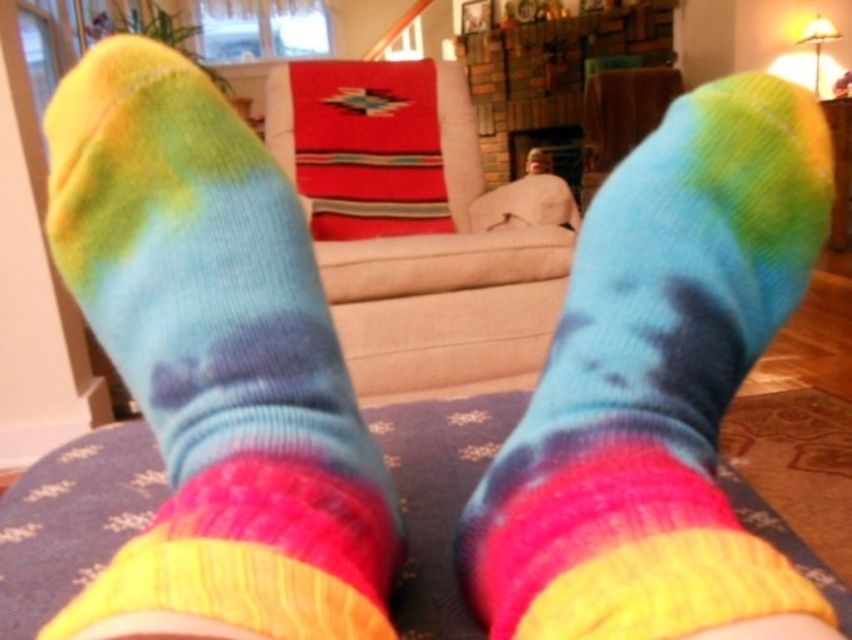
Question: Which point is farther from the camera taking this photo?

Choices:
 (A) (131, 300)
 (B) (41, 598)
 (C) (790, 589)

Answer: (B)

Question: Can you confirm if tie-dye knit sock at center is bigger than textured blue mat at center?

Choices:
 (A) no
 (B) yes

Answer: (A)

Question: Which object is the farthest from the tie-dye fabric sock at center?

Choices:
 (A) tie-dye knit sock at center
 (B) textured blue mat at center

Answer: (B)

Question: Does tie-dye fabric sock at center appear under textured blue mat at center?

Choices:
 (A) yes
 (B) no

Answer: (B)

Question: In this image, where is tie-dye knit sock at center located relative to textured blue mat at center?

Choices:
 (A) right
 (B) left

Answer: (B)

Question: Which object is farther from the camera taking this photo?

Choices:
 (A) textured blue mat at center
 (B) tie-dye fabric sock at center
 (C) tie-dye knit sock at center

Answer: (A)